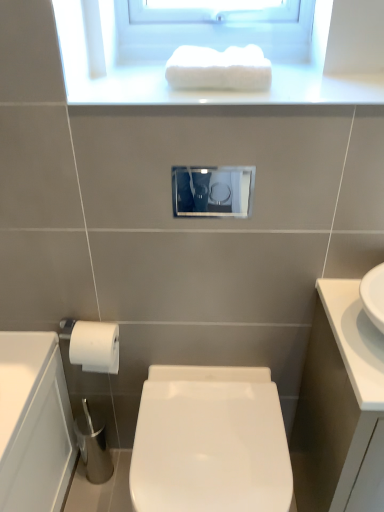
Question: Considering the relative positions of white glossy cabinet at right and white fluffy towel at upper center in the image provided, is white glossy cabinet at right to the right of white fluffy towel at upper center from the viewer's perspective?

Choices:
 (A) yes
 (B) no

Answer: (A)

Question: Is white glossy cabinet at right aimed at white fluffy towel at upper center?

Choices:
 (A) yes
 (B) no

Answer: (B)

Question: Is white glossy cabinet at right touching white fluffy towel at upper center?

Choices:
 (A) yes
 (B) no

Answer: (B)

Question: Is white glossy cabinet at right in front of white fluffy towel at upper center?

Choices:
 (A) yes
 (B) no

Answer: (A)

Question: Can you confirm if white glossy cabinet at right is bigger than white fluffy towel at upper center?

Choices:
 (A) yes
 (B) no

Answer: (A)

Question: Relative to white glossy cabinet at right, is white fluffy towel at upper center in front or behind?

Choices:
 (A) front
 (B) behind

Answer: (B)

Question: Is white fluffy towel at upper center inside or outside of white glossy cabinet at right?

Choices:
 (A) outside
 (B) inside

Answer: (A)

Question: Considering the positions of white fluffy towel at upper center and white glossy cabinet at right in the image, is white fluffy towel at upper center wider or thinner than white glossy cabinet at right?

Choices:
 (A) wide
 (B) thin

Answer: (B)

Question: Based on their positions, is white fluffy towel at upper center located to the left or right of white glossy cabinet at right?

Choices:
 (A) right
 (B) left

Answer: (B)

Question: Is point (211, 195) closer or farther from the camera than point (352, 82)?

Choices:
 (A) closer
 (B) farther

Answer: (B)

Question: From the image's perspective, is matte glass medicine cabinet at center above or below white glossy towel at upper center?

Choices:
 (A) below
 (B) above

Answer: (A)

Question: Is matte glass medicine cabinet at center wider or thinner than white glossy towel at upper center?

Choices:
 (A) wide
 (B) thin

Answer: (B)

Question: Considering the positions of matte glass medicine cabinet at center and white glossy towel at upper center in the image, is matte glass medicine cabinet at center taller or shorter than white glossy towel at upper center?

Choices:
 (A) tall
 (B) short

Answer: (A)

Question: In the image, is white fluffy towel at upper center positioned in front of or behind white glossy toilet at center?

Choices:
 (A) behind
 (B) front

Answer: (A)

Question: From their relative heights in the image, would you say white fluffy towel at upper center is taller or shorter than white glossy toilet at center?

Choices:
 (A) short
 (B) tall

Answer: (A)